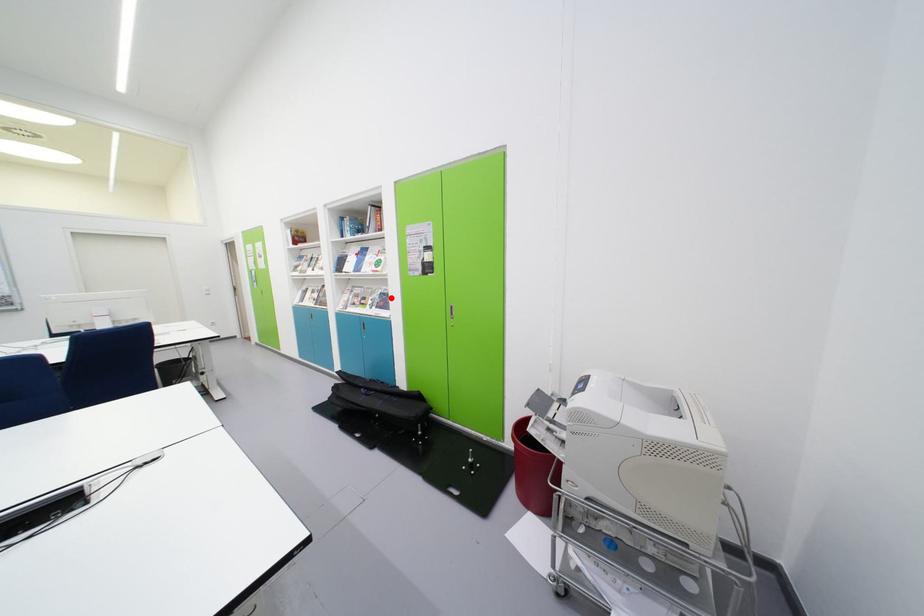
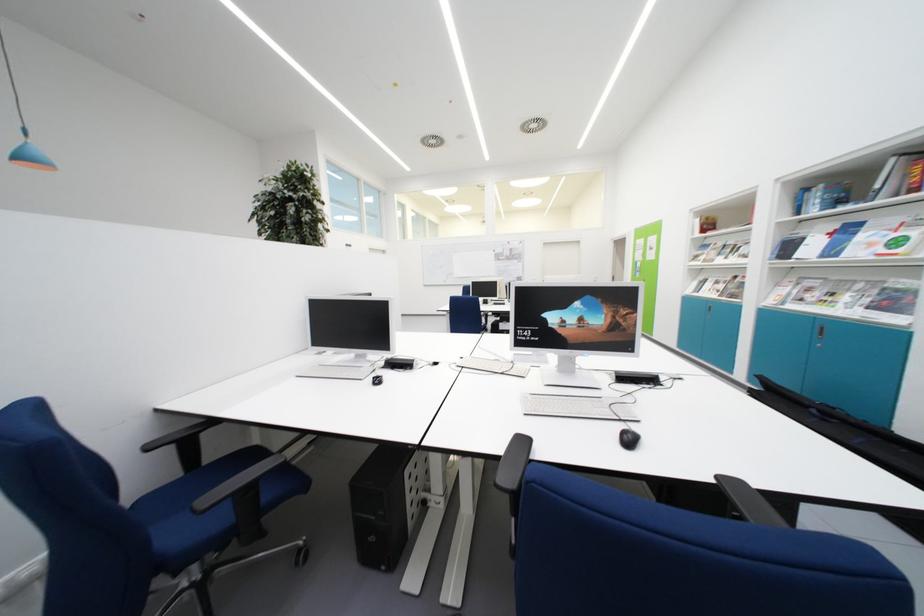
Find the pixel in the second image that matches the highlighted location in the first image.

(903, 294)